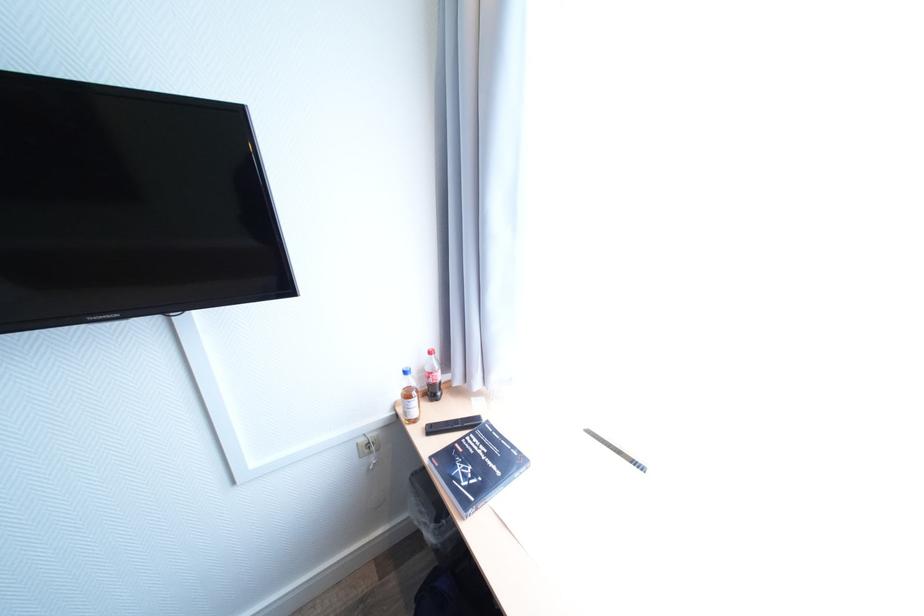
What do you see at coordinates (432, 376) in the screenshot? I see `the red bottle cap` at bounding box center [432, 376].